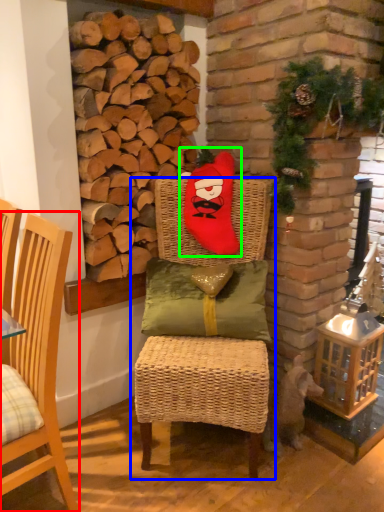
Question: Which object is the farthest from chair (highlighted by a red box)? Choose among these: chair (highlighted by a blue box) or santa claus (highlighted by a green box).

Choices:
 (A) chair
 (B) santa claus

Answer: (B)